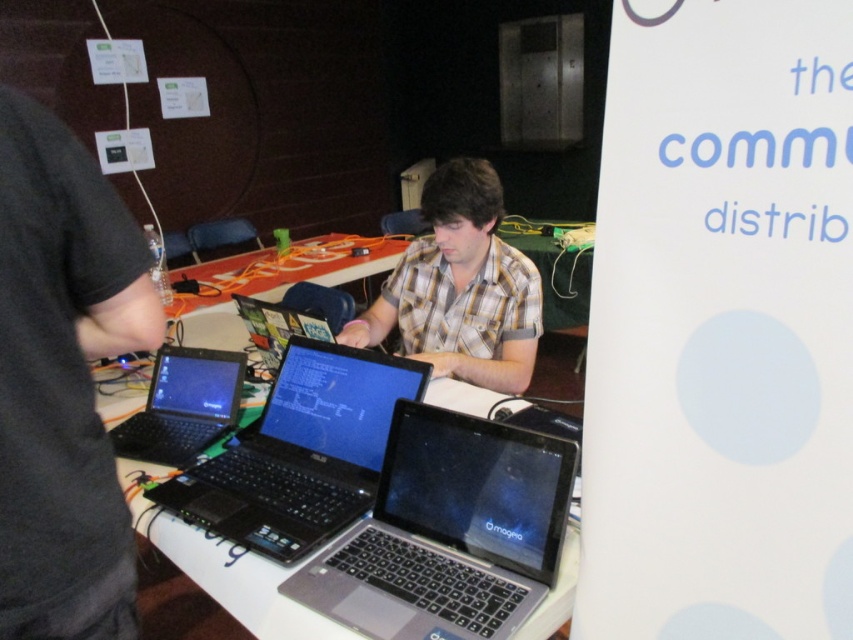
Between white plastic table at center and black glossy laptop at lower left, which one appears on the right side from the viewer's perspective?

black glossy laptop at lower left

I want to click on white plastic table at center, so click(x=223, y=568).

Locate an element on the screen. The width and height of the screenshot is (853, 640). white plastic table at center is located at coordinates tap(223, 568).

From the picture: Can you confirm if plaid fabric shirt at center is positioned to the right of black glossy laptop at lower left?

Yes, plaid fabric shirt at center is to the right of black glossy laptop at lower left.

Can you confirm if plaid fabric shirt at center is thinner than black glossy laptop at lower left?

In fact, plaid fabric shirt at center might be wider than black glossy laptop at lower left.

Does point (422, 275) come farther from viewer compared to point (158, 406)?

That is True.

The height and width of the screenshot is (640, 853). I want to click on plaid fabric shirt at center, so click(460, 288).

Is sleek silver laptop at center bigger than white plastic table at center?

No, sleek silver laptop at center is not bigger than white plastic table at center.

Who is positioned more to the right, sleek silver laptop at center or white plastic table at center?

sleek silver laptop at center

Identify the location of sleek silver laptop at center. point(448,532).